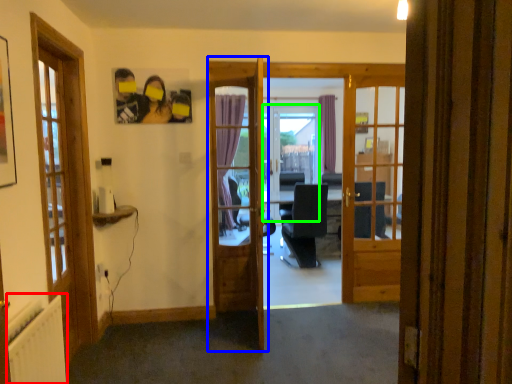
Question: Which is farther away from radiator (highlighted by a red box)? door (highlighted by a blue box) or screen door (highlighted by a green box)?

Choices:
 (A) door
 (B) screen door

Answer: (B)